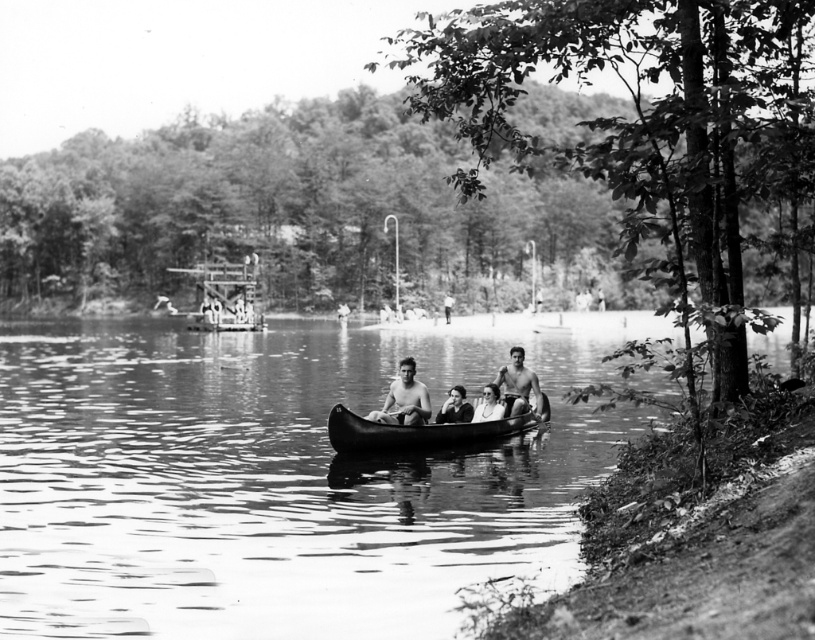
Is smooth wood canoe at center wider than shiny silver canoe at center?

Yes, smooth wood canoe at center is wider than shiny silver canoe at center.

Which of these two, smooth wood canoe at center or shiny silver canoe at center, stands taller?

With more height is shiny silver canoe at center.

Locate an element on the screen. The height and width of the screenshot is (640, 815). smooth wood canoe at center is located at coordinates (421, 432).

Where is `smooth wood canoe at center`? The image size is (815, 640). smooth wood canoe at center is located at coordinates click(421, 432).

Which is more to the left, smooth water at center or smooth wooden canoe at center?

Positioned to the left is smooth wooden canoe at center.

Which is behind, point (142, 470) or point (424, 416)?

Positioned behind is point (424, 416).

In order to click on smooth water at center in this screenshot , I will do `click(278, 477)`.

Between smooth wood canoe at center and smooth wooden canoe at center, which one has more height?

Standing taller between the two is smooth wood canoe at center.

Is smooth wood canoe at center further to the viewer compared to smooth wooden canoe at center?

No, smooth wood canoe at center is in front of smooth wooden canoe at center.

The height and width of the screenshot is (640, 815). I want to click on smooth wood canoe at center, so click(421, 432).